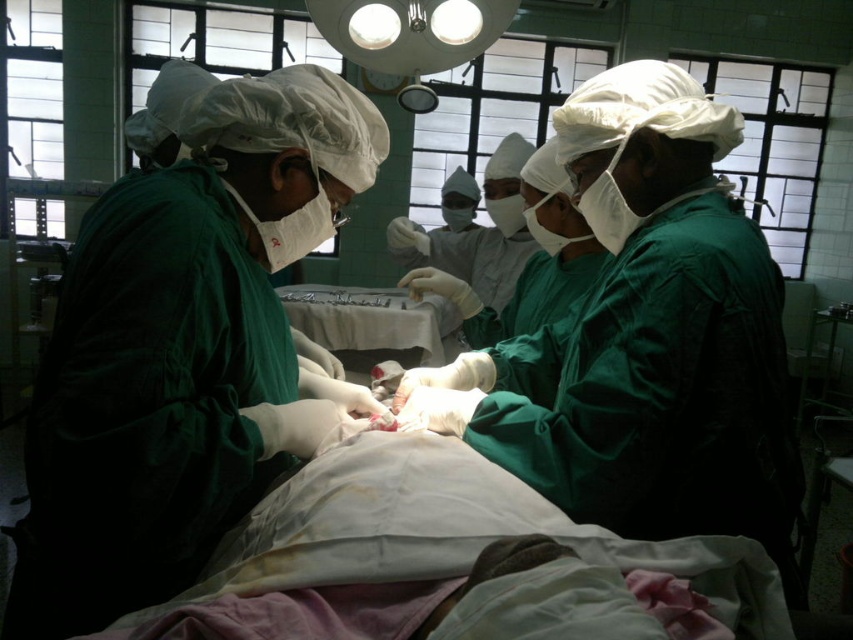
Question: Which point is farther to the camera?

Choices:
 (A) satin white tray at center
 (B) green matte surgical gown at center

Answer: (A)

Question: Which point is farther to the camera?

Choices:
 (A) (296, 296)
 (B) (311, 131)

Answer: (A)

Question: Is green matte surgical gown at center to the right of satin white tray at center from the viewer's perspective?

Choices:
 (A) yes
 (B) no

Answer: (A)

Question: Does green matte surgical gown at center have a smaller size compared to satin white tray at center?

Choices:
 (A) no
 (B) yes

Answer: (A)

Question: Where is green matte surgical gown at center located in relation to satin white tray at center in the image?

Choices:
 (A) below
 (B) above

Answer: (A)

Question: Which of the following is the farthest from the observer?

Choices:
 (A) satin white tray at center
 (B) green matte surgical gown at center

Answer: (A)